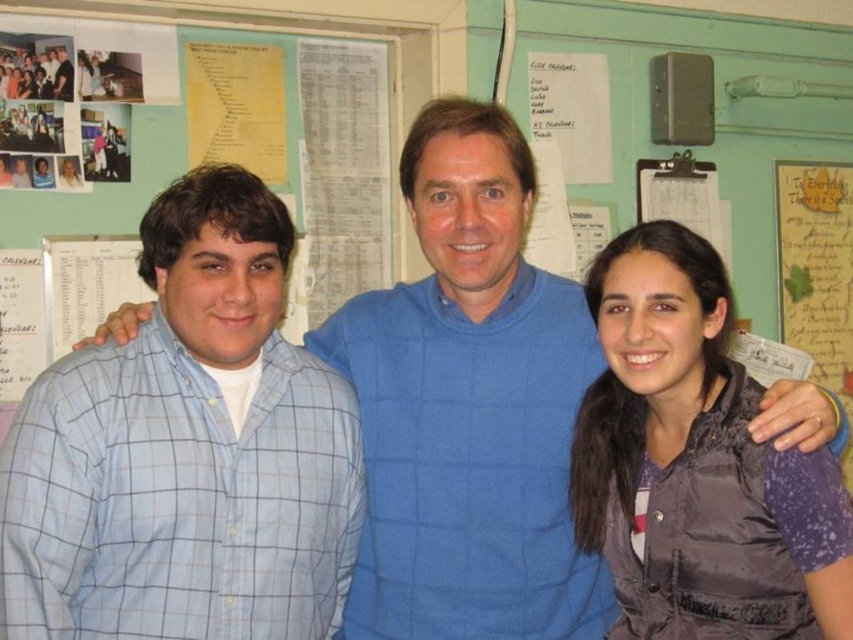
Image resolution: width=853 pixels, height=640 pixels. Describe the element at coordinates (187, 451) in the screenshot. I see `blue checkered shirt at left` at that location.

Is point (229, 536) closer to camera compared to point (614, 300)?

Yes.

The image size is (853, 640). Find the location of `blue checkered shirt at left`. blue checkered shirt at left is located at coordinates (187, 451).

Can you confirm if blue checkered shirt at left is positioned below matte black shirt at upper left?

Correct, blue checkered shirt at left is located below matte black shirt at upper left.

Between blue checkered shirt at left and matte black shirt at upper left, which one is positioned higher?

matte black shirt at upper left is above.

Where is `blue checkered shirt at left`? blue checkered shirt at left is located at coordinates (187, 451).

Can you confirm if dark gray puffy vest at right is bigger than matte black shirt at upper left?

Yes.

Who is more forward, (746, 417) or (67, 83)?

Positioned in front is point (746, 417).

Who is more forward, (x=747, y=602) or (x=59, y=60)?

Point (x=747, y=602) is in front.

I want to click on dark gray puffy vest at right, so click(x=689, y=458).